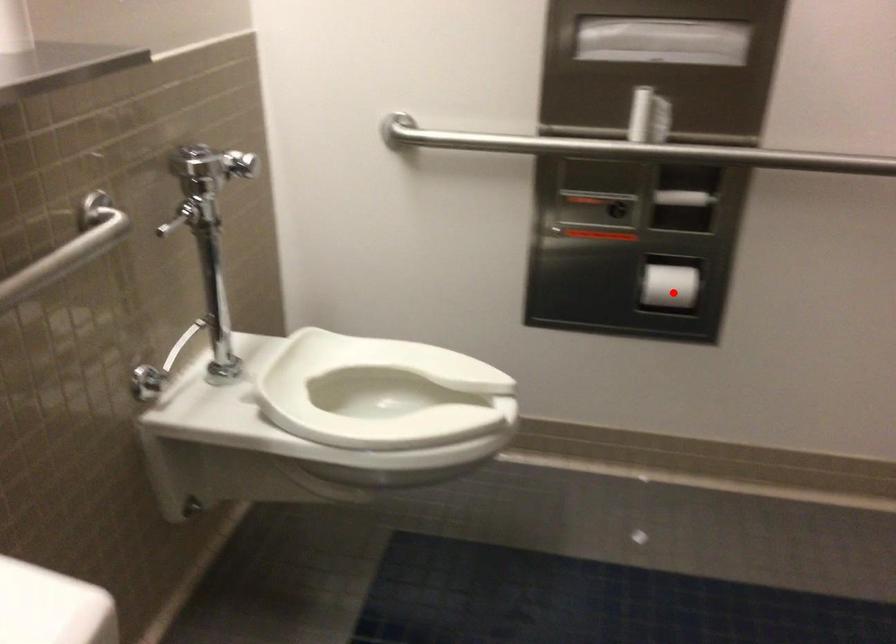
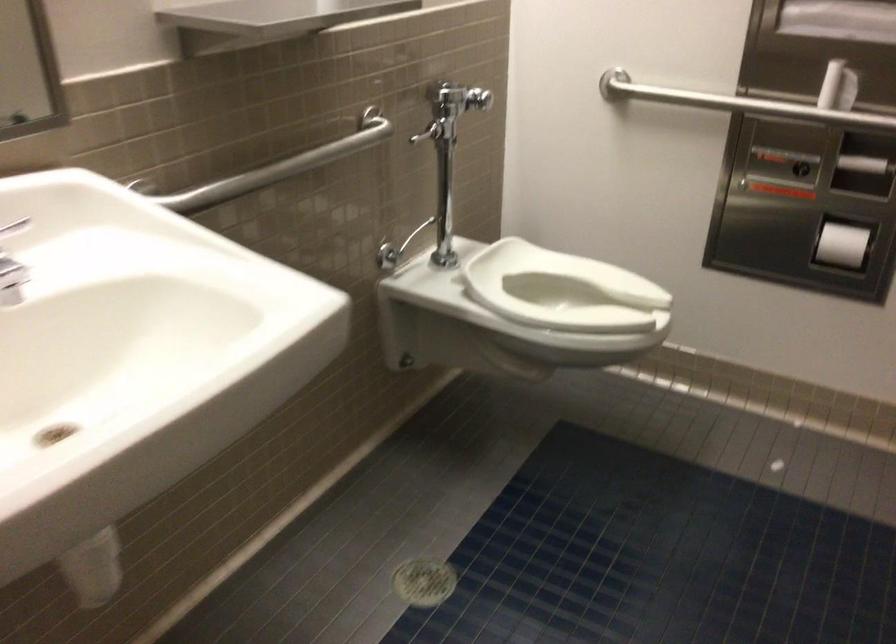
Locate, in the second image, the point that corresponds to the highlighted location in the first image.

(841, 245)